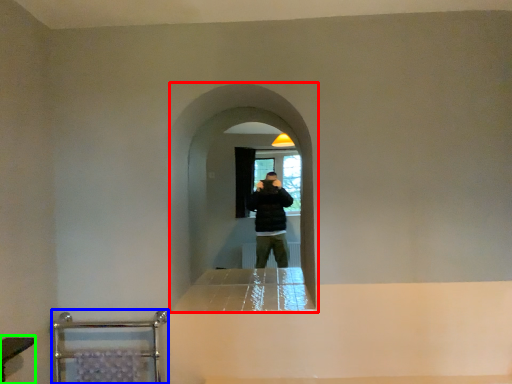
Question: Which object is positioned farthest from screen door (highlighted by a red box)? Select from balustrade (highlighted by a blue box) and vanity (highlighted by a green box).

Choices:
 (A) balustrade
 (B) vanity

Answer: (B)